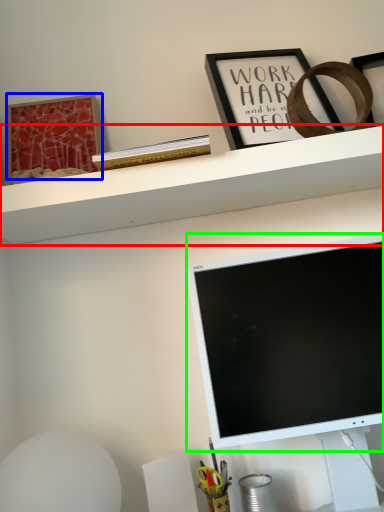
Question: Which is nearer to the shelf (highlighted by a red box)? picture frame (highlighted by a blue box) or computer monitor (highlighted by a green box).

Choices:
 (A) picture frame
 (B) computer monitor

Answer: (B)